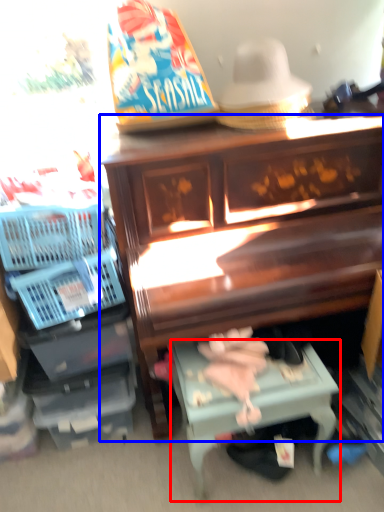
Question: Which object appears closest to the camera in this image, table (highlighted by a red box) or furniture (highlighted by a blue box)?

Choices:
 (A) table
 (B) furniture

Answer: (B)